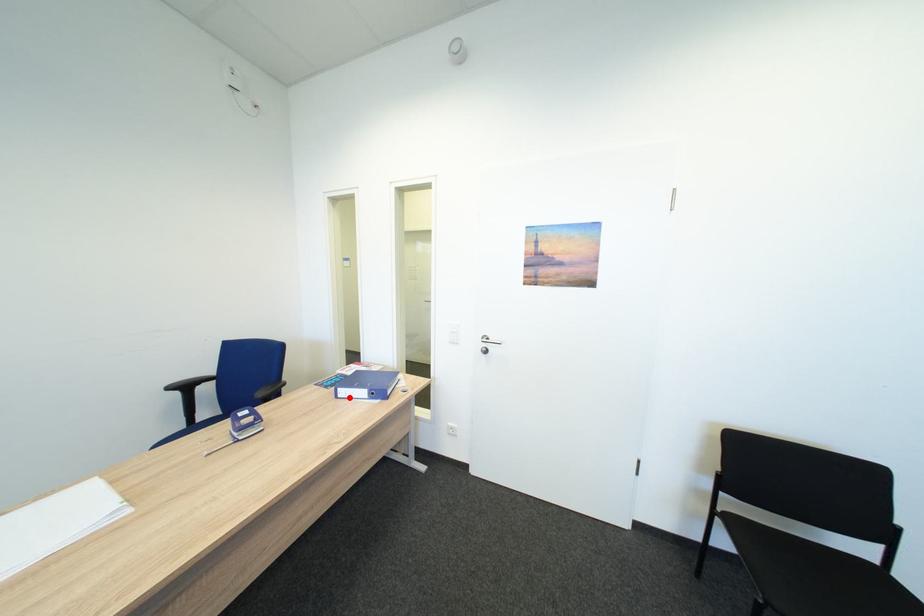
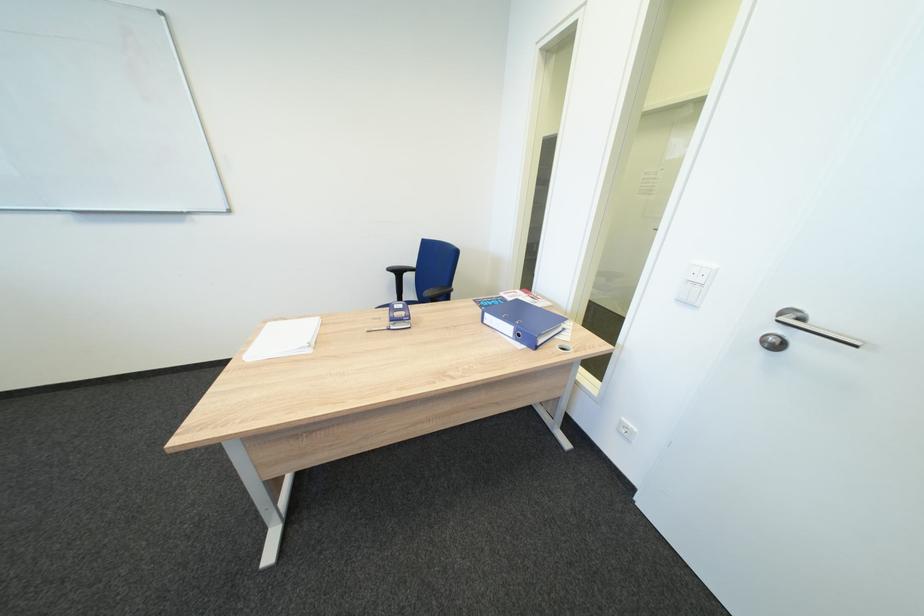
Find the pixel in the second image that matches the highlighted location in the first image.

(495, 323)